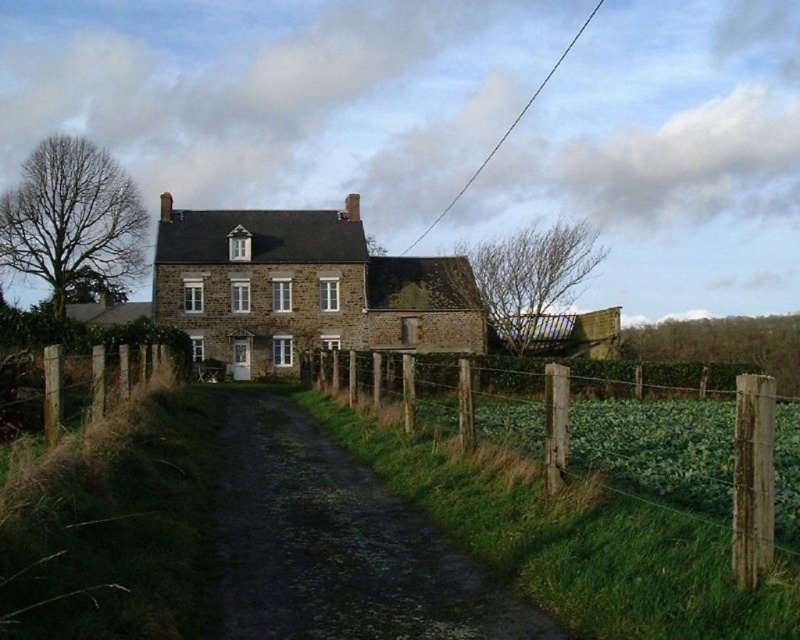
Question: Which point appears farthest from the camera in this image?

Choices:
 (A) (277, 634)
 (B) (424, 413)

Answer: (B)

Question: Is dirt/gravel path at center wider than wooden post fence at right?

Choices:
 (A) no
 (B) yes

Answer: (A)

Question: Which point is closer to the camera?

Choices:
 (A) dirt/gravel path at center
 (B) wooden post fence at right

Answer: (A)

Question: Is dirt/gravel path at center above wooden post fence at right?

Choices:
 (A) yes
 (B) no

Answer: (B)

Question: Which point is farther from the camera taking this photo?

Choices:
 (A) (724, 467)
 (B) (310, 620)

Answer: (A)

Question: Is dirt/gravel path at center smaller than wooden post fence at right?

Choices:
 (A) no
 (B) yes

Answer: (B)